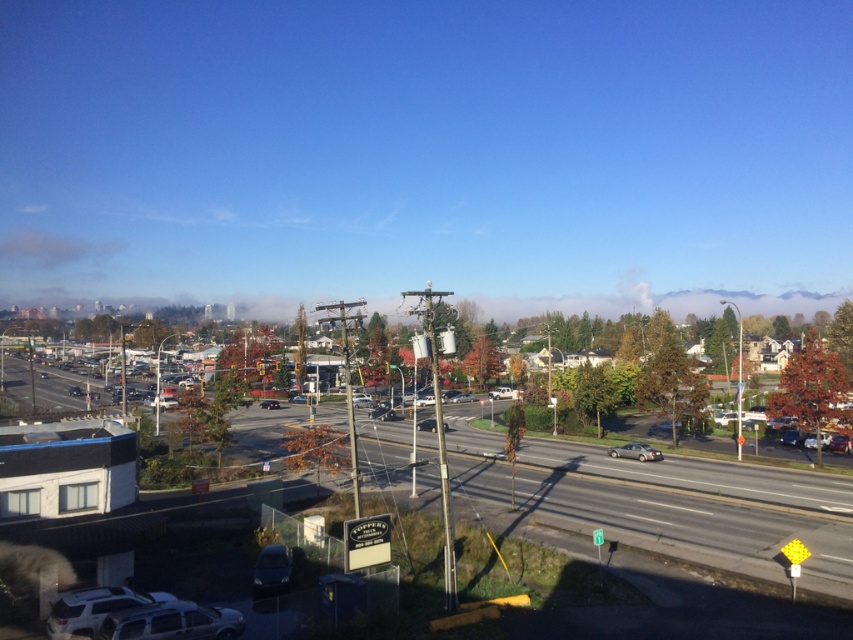
You are a delivery driver who needs to load a tall package into your truck. You see a metallic silver sedan at center and a shiny black sedan at center. Which car has more vertical space to accommodate the package?

The metallic silver sedan at center is much taller than the shiny black sedan at center, so it has more vertical space to accommodate the package.

You are a delivery driver who needs to park your vehicle in a spot that can accommodate larger vehicles. You see a metallic silver sedan at center and a shiny black sedan at center. Which vehicle requires a larger parking space?

The metallic silver sedan at center requires a larger parking space because it is bigger than the shiny black sedan at center.

You are standing at the point with coordinates (694,508) in the suburban scene. What type of surface are you currently standing on?

You are standing on asphalt road at lower center.